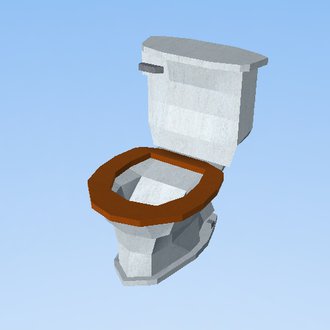
What are the coordinates of `toilet` in the screenshot? It's located at click(195, 136).